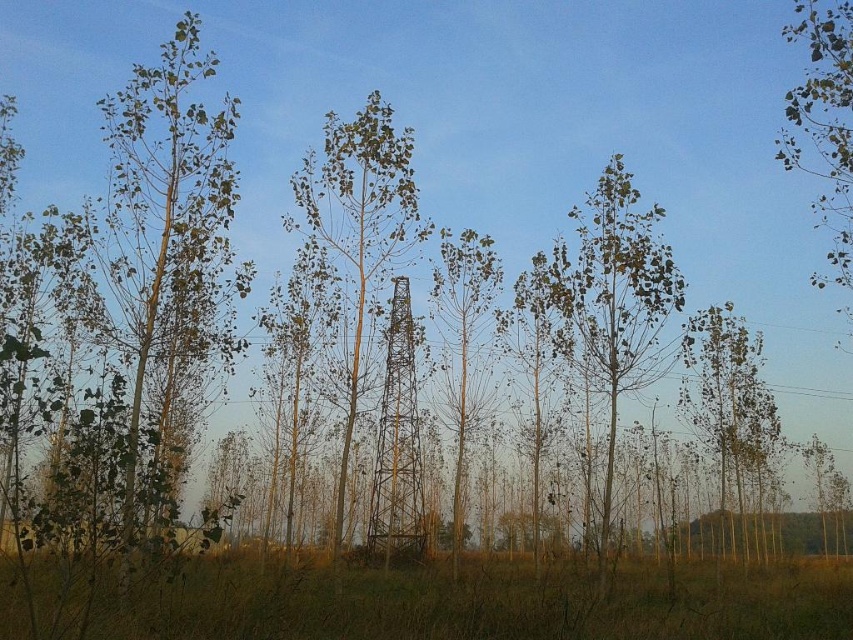
Question: Is brown grass at lower center below green leafy tree at center?

Choices:
 (A) no
 (B) yes

Answer: (B)

Question: Estimate the real-world distances between objects in this image. Which object is closer to the green matte tree at upper right?

Choices:
 (A) brown grass at lower center
 (B) green leafy tree at center

Answer: (A)

Question: Is the position of green matte tree at center less distant than that of green leafy tree at center?

Choices:
 (A) no
 (B) yes

Answer: (B)

Question: Which point appears farthest from the camera in this image?

Choices:
 (A) (105, 595)
 (B) (480, 353)
 (C) (572, 328)

Answer: (B)

Question: Which of the following is the farthest from the observer?

Choices:
 (A) (465, 353)
 (B) (817, 16)

Answer: (A)

Question: Is green matte tree at center thinner than green leafy birch tree at center?

Choices:
 (A) no
 (B) yes

Answer: (B)